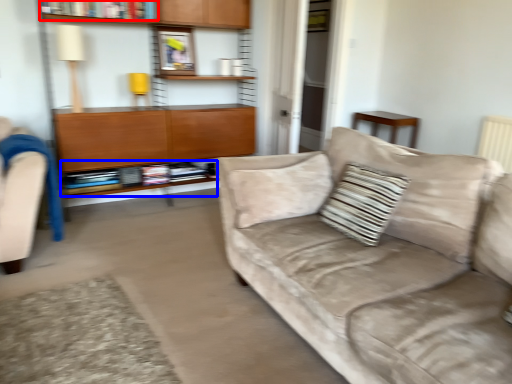
Question: Among these objects, which one is farthest to the camera, book (highlighted by a red box) or book (highlighted by a blue box)?

Choices:
 (A) book
 (B) book

Answer: (B)